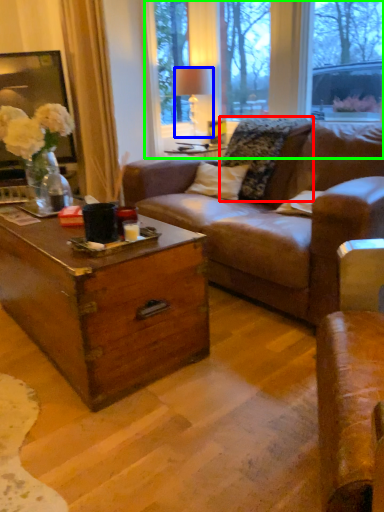
Question: Considering the real-world distances, which object is farthest from pillow (highlighted by a red box)? lamp (highlighted by a blue box) or bay window (highlighted by a green box)?

Choices:
 (A) lamp
 (B) bay window

Answer: (B)